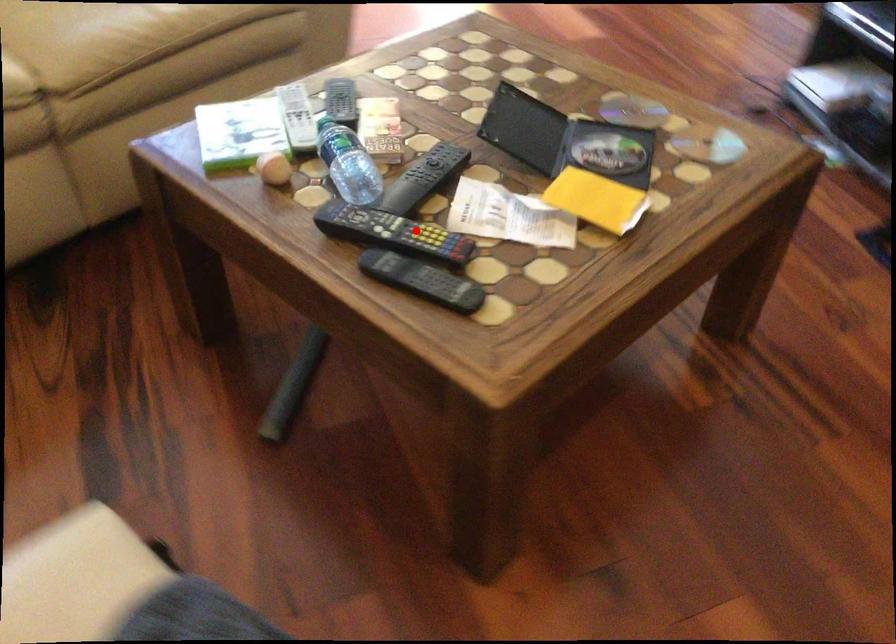
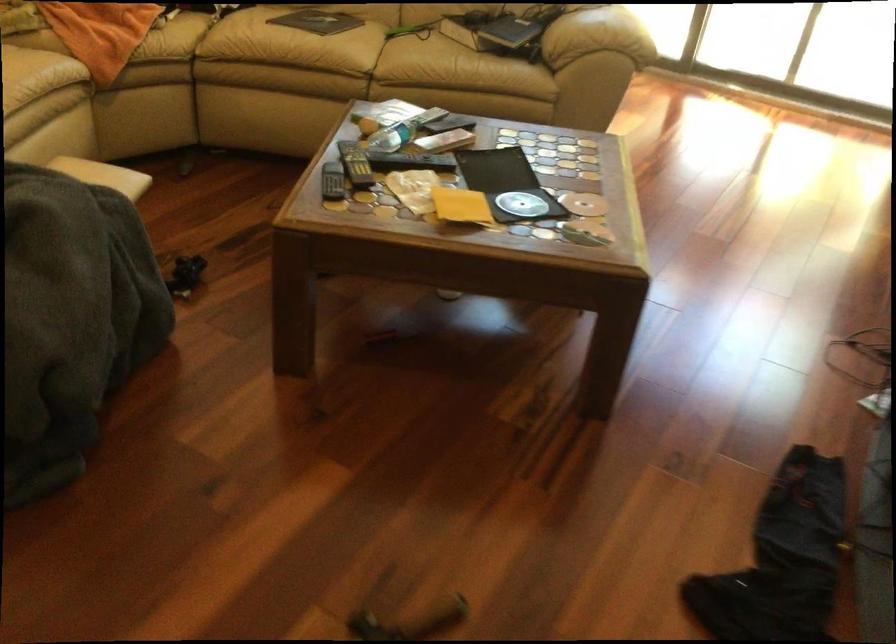
Question: A red point is marked in image1. In image2, is the corresponding 3D point closer to the camera or farther? Reply with the corresponding letter.

Choices:
 (A) The corresponding 3D point is closer.
 (B) The corresponding 3D point is farther.

Answer: (B)